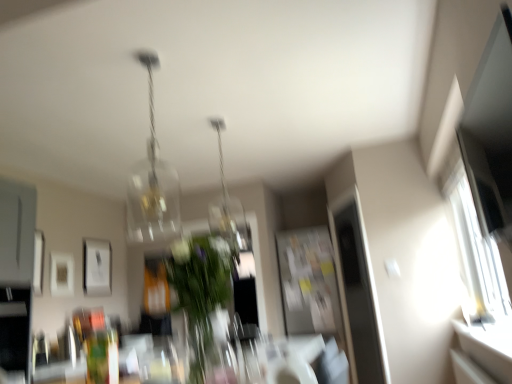
Question: Which direction should I rotate to look at translucent glass chandelier at upper center, which ranks as the 1th lamp in left-to-right order?

Choices:
 (A) left
 (B) right

Answer: (A)

Question: Which direction should I rotate to look at clear glass pendant light at center, which ranks as the second lamp in left-to-right order, — up or down?

Choices:
 (A) down
 (B) up

Answer: (B)

Question: Is white matte picture frame at upper left, the 1th picture frame viewed from the right, facing towards translucent glass chandelier at upper center, positioned as the 2th lamp in right-to-left order?

Choices:
 (A) yes
 (B) no

Answer: (B)

Question: Is white matte picture frame at upper left, arranged as the third picture frame when viewed from the front, facing away from translucent glass chandelier at upper center, positioned as the first lamp in front-to-back order?

Choices:
 (A) no
 (B) yes

Answer: (A)

Question: From a real-world perspective, is white matte picture frame at upper left, the third picture frame viewed from the left, under translucent glass chandelier at upper center, which appears as the 2th lamp when viewed from the back?

Choices:
 (A) yes
 (B) no

Answer: (A)

Question: Considering the relative sizes of white matte picture frame at upper left, the third picture frame viewed from the left, and translucent glass chandelier at upper center, which appears as the 2th lamp when viewed from the back, in the image provided, is white matte picture frame at upper left, the third picture frame viewed from the left, bigger than translucent glass chandelier at upper center, which appears as the 2th lamp when viewed from the back,?

Choices:
 (A) yes
 (B) no

Answer: (B)

Question: Does white matte picture frame at upper left, the 1th picture frame when ordered from back to front, have a lesser width compared to translucent glass chandelier at upper center, positioned as the 2th lamp in right-to-left order?

Choices:
 (A) no
 (B) yes

Answer: (B)

Question: Would you say translucent glass chandelier at upper center, which ranks as the 1th lamp in left-to-right order, is part of white matte picture frame at upper left, the 1th picture frame viewed from the right,'s contents?

Choices:
 (A) no
 (B) yes

Answer: (A)

Question: Is white matte picture frame at upper left, the 1th picture frame viewed from the right, wider than matte white picture frame at left, which is counted as the first picture frame, starting from the left?

Choices:
 (A) yes
 (B) no

Answer: (A)

Question: From the image's perspective, is white matte picture frame at upper left, arranged as the third picture frame when viewed from the front, on matte white picture frame at left, the first picture frame from the front?

Choices:
 (A) yes
 (B) no

Answer: (B)

Question: Considering the relative positions of white matte picture frame at upper left, the 1th picture frame when ordered from back to front, and matte white picture frame at left, the first picture frame from the front, in the image provided, is white matte picture frame at upper left, the 1th picture frame when ordered from back to front, in front of matte white picture frame at left, the first picture frame from the front,?

Choices:
 (A) yes
 (B) no

Answer: (B)

Question: Does white matte picture frame at upper left, arranged as the third picture frame when viewed from the front, have a lesser height compared to matte white picture frame at left, the third picture frame when ordered from right to left?

Choices:
 (A) no
 (B) yes

Answer: (A)

Question: Is white matte picture frame at upper left, the 1th picture frame when ordered from back to front, turned away from matte white picture frame at left, the first picture frame from the front?

Choices:
 (A) yes
 (B) no

Answer: (B)

Question: Is white matte picture frame at upper left, the third picture frame viewed from the left, facing towards matte white picture frame at left, the first picture frame from the front?

Choices:
 (A) no
 (B) yes

Answer: (A)

Question: Is the depth of translucent glass chandelier at upper center, which appears as the 2th lamp when viewed from the back, less than that of clear glass pendant light at center, placed as the first lamp when sorted from right to left?

Choices:
 (A) no
 (B) yes

Answer: (B)